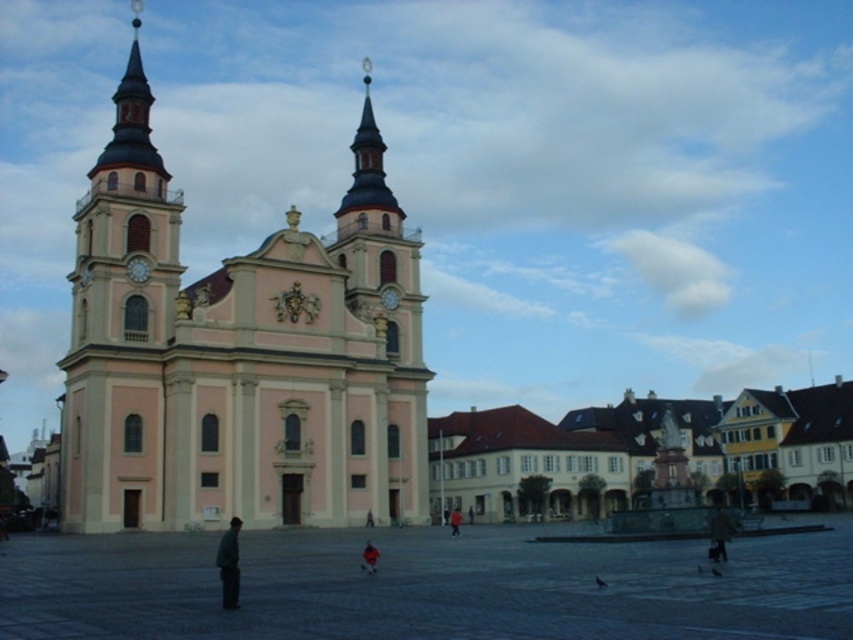
You are standing in the square and want to take a photo of the pink smooth church at center. Since the dark gray stone square at center is in your view, will it block your view of the church?

The dark gray stone square at center is behind the pink smooth church at center, so it will not block your view of the church.